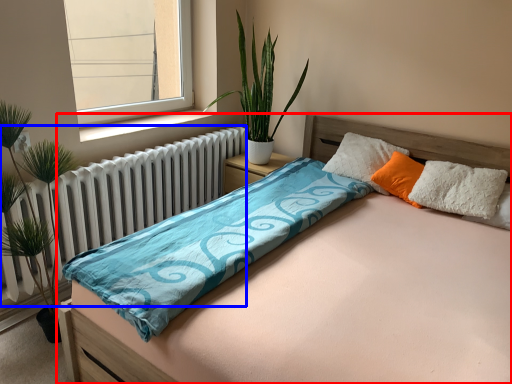
Question: Which object is closer to the camera taking this photo, bed (highlighted by a red box) or radiator (highlighted by a blue box)?

Choices:
 (A) bed
 (B) radiator

Answer: (A)